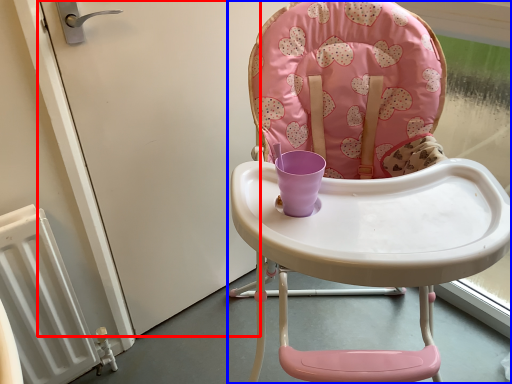
Question: Among these objects, which one is nearest to the camera, screen door (highlighted by a red box) or chair (highlighted by a blue box)?

Choices:
 (A) screen door
 (B) chair

Answer: (B)